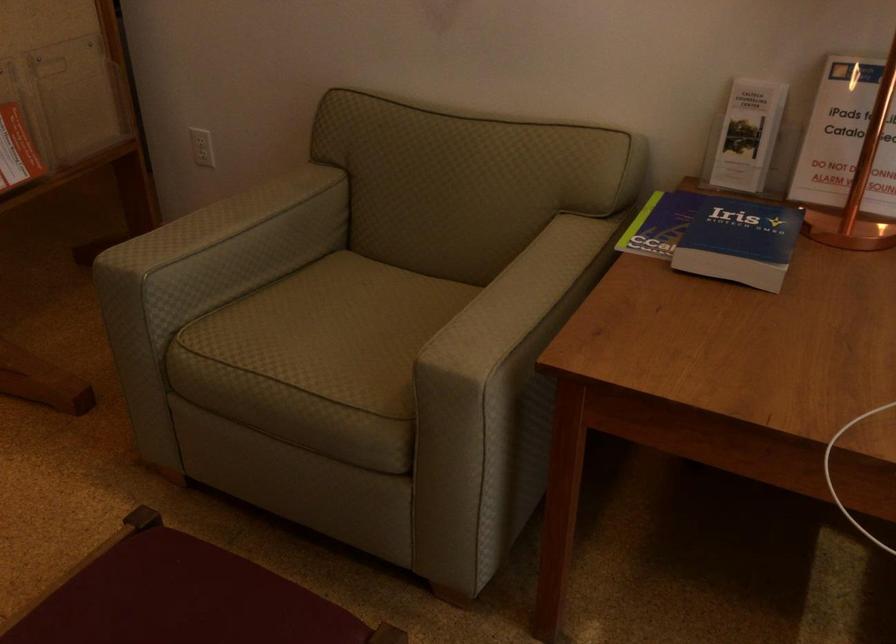
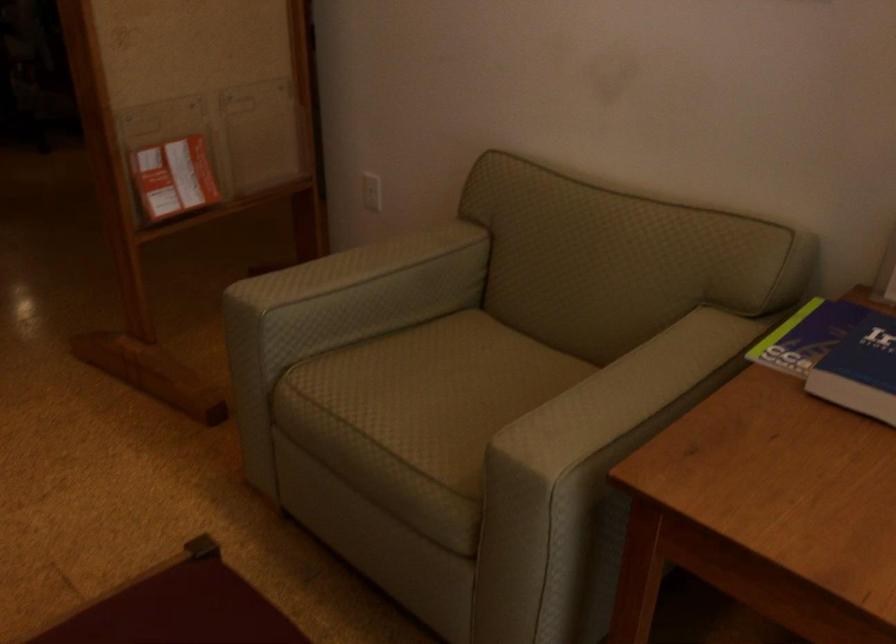
Question: The camera is either moving clockwise (left) or counter-clockwise (right) around the object. The first image is from the beginning of the video and the second image is from the end. Is the camera moving left or right when shooting the video?

Choices:
 (A) Left
 (B) Right

Answer: (B)